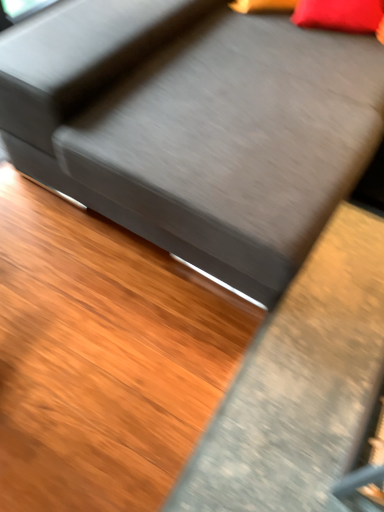
What is the approximate height of matte gray fabric couch at center?

matte gray fabric couch at center is 34.76 inches tall.

Locate an element on the screen. matte gray fabric couch at center is located at coordinates (195, 126).

This screenshot has height=512, width=384. Describe the element at coordinates (195, 126) in the screenshot. I see `matte gray fabric couch at center` at that location.

This screenshot has height=512, width=384. I want to click on matte gray fabric couch at center, so click(x=195, y=126).